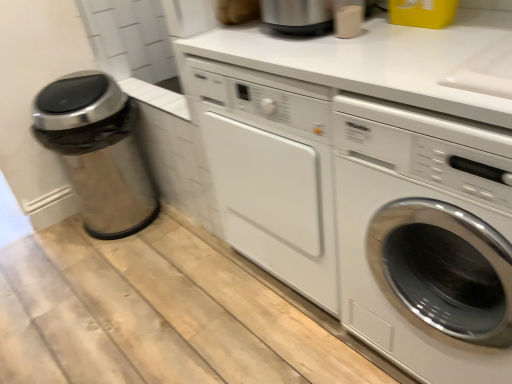
You are a GUI agent. You are given a task and a screenshot of the screen. Output one action in this format:
    pyautogui.click(x=<x>, y=<y>)
    Task: Click on the free space above white glossy washing machine at center right (from a real-world perspective)
    
    Given the screenshot: What is the action you would take?
    pyautogui.click(x=462, y=49)